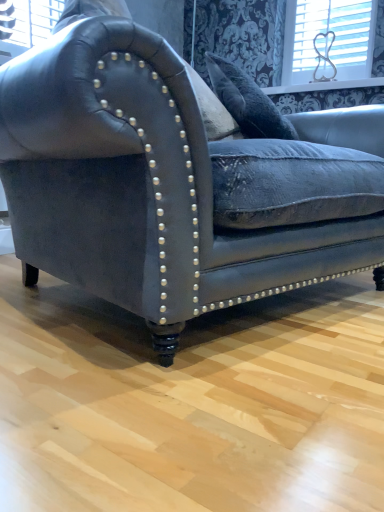
Question: From the image's perspective, is white plastic heart at upper right located above or below matte black leather couch at center?

Choices:
 (A) above
 (B) below

Answer: (A)

Question: From a real-world perspective, is white plastic heart at upper right positioned above or below matte black leather couch at center?

Choices:
 (A) above
 (B) below

Answer: (A)

Question: Considering the relative positions of white plastic heart at upper right and matte black leather couch at center in the image provided, is white plastic heart at upper right to the left or to the right of matte black leather couch at center?

Choices:
 (A) left
 (B) right

Answer: (B)

Question: Considering the positions of matte black leather couch at center and white plastic heart at upper right in the image, is matte black leather couch at center wider or thinner than white plastic heart at upper right?

Choices:
 (A) thin
 (B) wide

Answer: (B)

Question: Is point (125, 220) closer or farther from the camera than point (288, 64)?

Choices:
 (A) farther
 (B) closer

Answer: (B)

Question: From a real-world perspective, is matte black leather couch at center physically located above or below white plastic heart at upper right?

Choices:
 (A) above
 (B) below

Answer: (B)

Question: In the image, is matte black leather couch at center positioned in front of or behind white plastic heart at upper right?

Choices:
 (A) behind
 (B) front

Answer: (B)